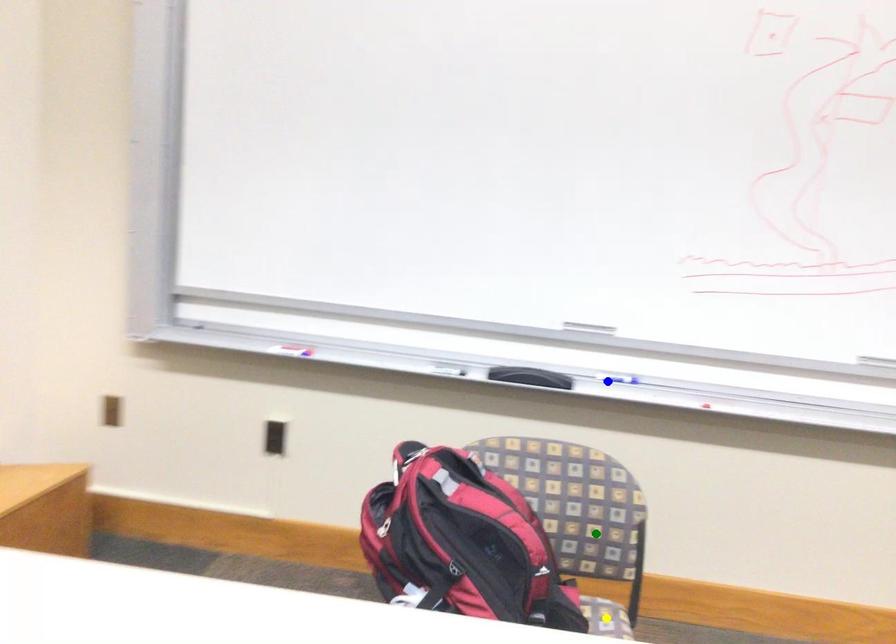
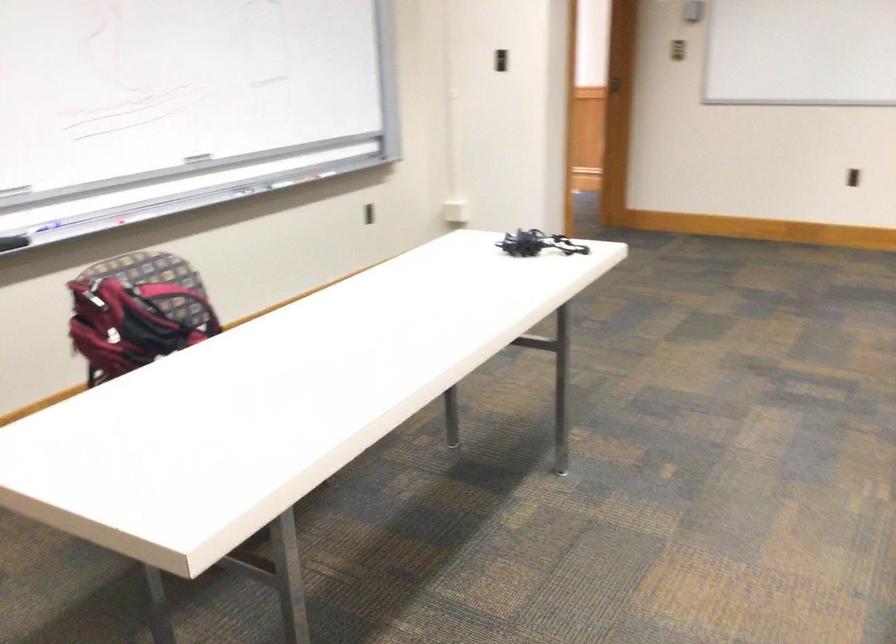
I am providing you with two images of the same scene from different viewpoints. Three points are marked in image1. Which point corresponds to a part or object that is occluded in image2?In image1, three points are marked. Which of them correspond to a part or object that is occluded in image2?Among the three points shown in image1, which one corresponds to a part or object that is no longer visible due to occlusion in image2?

yellow point cannot be seen in image2.